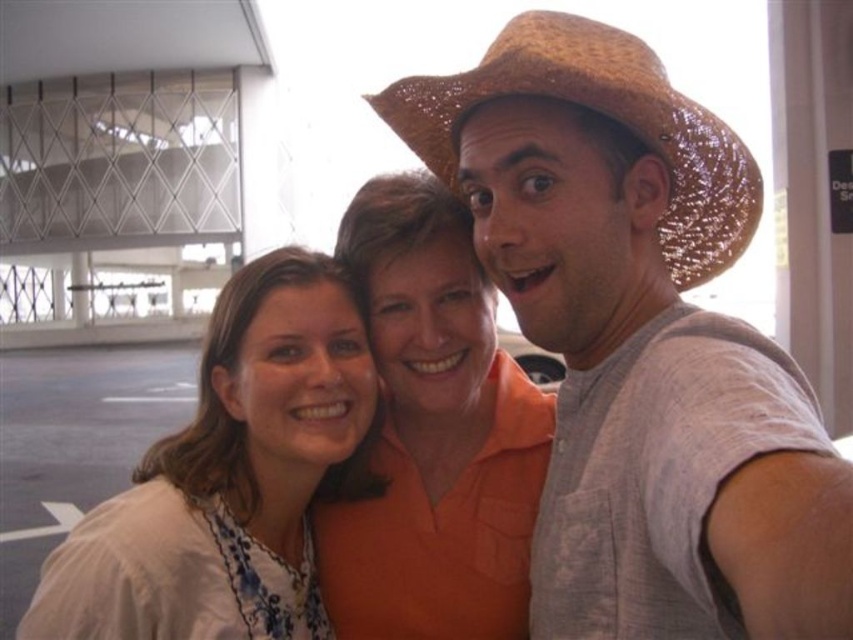
From the picture: You are trying to locate the point with coordinates (434, 435) in the image. Which object from the scene does this point lie on?

The point with coordinates (434, 435) lies on the orange cotton shirt at center.

You are a photographer adjusting the framing for a group photo. You need to ensure that the straw hat at upper right and the orange cotton shirt at center are within a 24 inch distance to maintain proper composition. Based on the scene, does the current arrangement meet this requirement?

The distance between the straw hat at upper right and the orange cotton shirt at center is 23.89 inches, which is just under the 24 inch requirement. Therefore, the current arrangement meets the composition requirement.